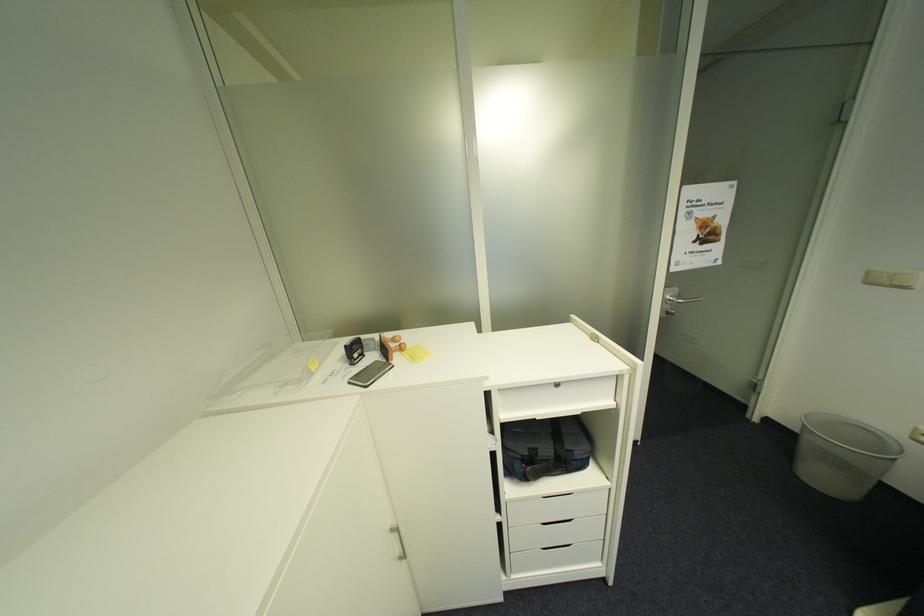
You are a GUI agent. You are given a task and a screenshot of the screen. Output one action in this format:
    pyautogui.click(x=<x>, y=<y>)
    Task: Click on the wooden handle stamp
    
    Given the screenshot: What is the action you would take?
    pyautogui.click(x=391, y=346)